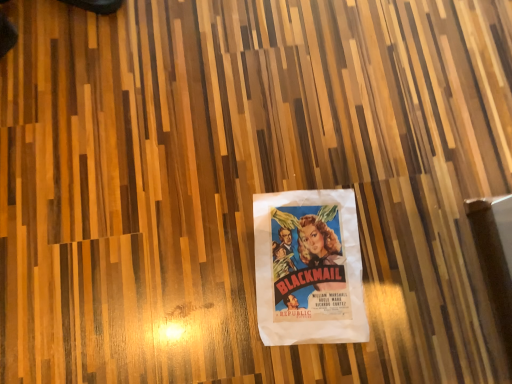
Question: Considering the positions of black leather shoe at upper left and white paper poster at center in the image, is black leather shoe at upper left wider or thinner than white paper poster at center?

Choices:
 (A) wide
 (B) thin

Answer: (B)

Question: From the image's perspective, relative to white paper poster at center, is black leather shoe at upper left above or below?

Choices:
 (A) above
 (B) below

Answer: (A)

Question: Is black leather shoe at upper left taller or shorter than white paper poster at center?

Choices:
 (A) tall
 (B) short

Answer: (A)

Question: Considering the relative positions of white paper poster at center and black leather shoe at upper left in the image provided, is white paper poster at center to the left or to the right of black leather shoe at upper left?

Choices:
 (A) right
 (B) left

Answer: (A)

Question: In the image, is white paper poster at center positioned in front of or behind black leather shoe at upper left?

Choices:
 (A) front
 (B) behind

Answer: (A)

Question: From the image's perspective, is white paper poster at center positioned above or below black leather shoe at upper left?

Choices:
 (A) above
 (B) below

Answer: (B)

Question: Is white paper poster at center wider or thinner than black leather shoe at upper left?

Choices:
 (A) thin
 (B) wide

Answer: (B)